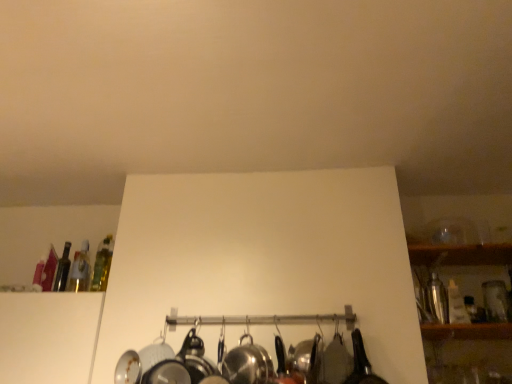
Question: From the image's perspective, would you say translucent glass bottle at left, which appears as the 3th bottle when viewed from the left, is positioned over shiny metallic shaker at right, arranged as the first bottle when viewed from the right?

Choices:
 (A) no
 (B) yes

Answer: (B)

Question: Is translucent glass bottle at left, placed as the second bottle when sorted from right to left, surrounding shiny metallic shaker at right, arranged as the first bottle when viewed from the right?

Choices:
 (A) yes
 (B) no

Answer: (B)

Question: From a real-world perspective, is translucent glass bottle at left, placed as the second bottle when sorted from right to left, physically above shiny metallic shaker at right, the 4th bottle from the left?

Choices:
 (A) yes
 (B) no

Answer: (A)

Question: Considering the relative positions of translucent glass bottle at left, placed as the second bottle when sorted from right to left, and shiny metallic shaker at right, the 4th bottle from the left, in the image provided, is translucent glass bottle at left, placed as the second bottle when sorted from right to left, to the right of shiny metallic shaker at right, the 4th bottle from the left, from the viewer's perspective?

Choices:
 (A) no
 (B) yes

Answer: (A)

Question: Is translucent glass bottle at left, placed as the second bottle when sorted from right to left, positioned beyond the bounds of shiny metallic shaker at right, the 4th bottle from the left?

Choices:
 (A) yes
 (B) no

Answer: (A)

Question: From a real-world perspective, relative to translucent glass bottle at upper left, which is counted as the fourth bottle, starting from the right, is translucent glass bottle at left, placed as the second bottle when sorted from right to left, vertically above or below?

Choices:
 (A) above
 (B) below

Answer: (A)

Question: From the image's perspective, relative to translucent glass bottle at upper left, which is counted as the fourth bottle, starting from the right, is translucent glass bottle at left, placed as the second bottle when sorted from right to left, above or below?

Choices:
 (A) below
 (B) above

Answer: (B)

Question: Based on their positions, is translucent glass bottle at left, which appears as the 3th bottle when viewed from the left, located to the left or right of translucent glass bottle at upper left, arranged as the 1th bottle when viewed from the left?

Choices:
 (A) right
 (B) left

Answer: (A)

Question: In terms of size, does translucent glass bottle at left, which appears as the 3th bottle when viewed from the left, appear bigger or smaller than translucent glass bottle at upper left, arranged as the 1th bottle when viewed from the left?

Choices:
 (A) small
 (B) big

Answer: (A)

Question: In the image, is translucent glass bottle at left, placed as the second bottle when sorted from right to left, positioned in front of or behind shiny metallic shaker at right, the 4th bottle from the left?

Choices:
 (A) behind
 (B) front

Answer: (A)

Question: From a real-world perspective, relative to shiny metallic shaker at right, the 4th bottle from the left, is translucent glass bottle at left, which appears as the 3th bottle when viewed from the left, vertically above or below?

Choices:
 (A) below
 (B) above

Answer: (B)

Question: Is translucent glass bottle at left, which appears as the 3th bottle when viewed from the left, taller or shorter than shiny metallic shaker at right, arranged as the first bottle when viewed from the right?

Choices:
 (A) short
 (B) tall

Answer: (B)

Question: From the image's perspective, is translucent glass bottle at left, which appears as the 3th bottle when viewed from the left, positioned above or below shiny metallic shaker at right, the 4th bottle from the left?

Choices:
 (A) above
 (B) below

Answer: (A)

Question: From the image's perspective, is shiny metallic shaker at right, the 4th bottle from the left, positioned above or below translucent glass bottle at upper left, arranged as the 1th bottle when viewed from the left?

Choices:
 (A) above
 (B) below

Answer: (B)

Question: Relative to translucent glass bottle at upper left, arranged as the 1th bottle when viewed from the left, is shiny metallic shaker at right, arranged as the first bottle when viewed from the right, in front or behind?

Choices:
 (A) behind
 (B) front

Answer: (B)